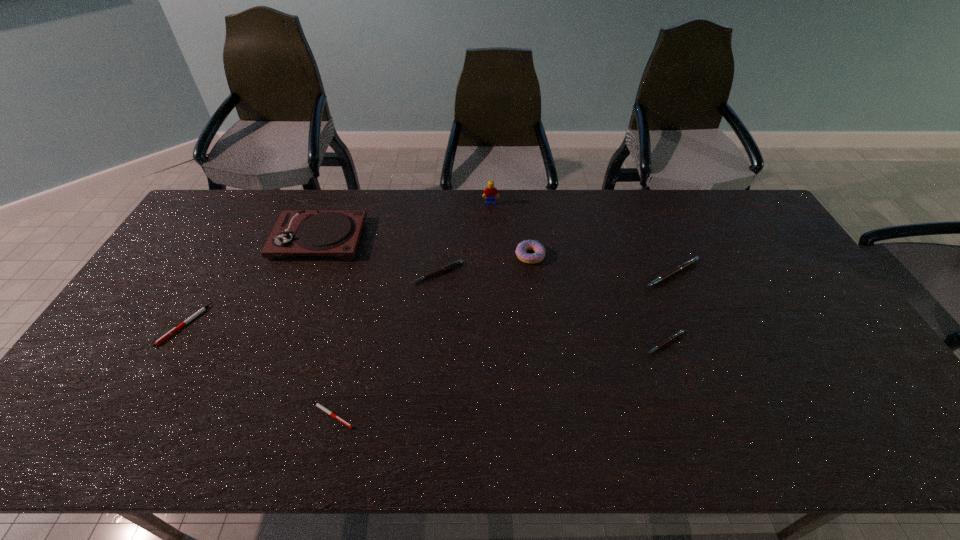
Identify the location of vacant point at the near left corner. (51, 432).

You are a GUI agent. You are given a task and a screenshot of the screen. Output one action in this format:
    pyautogui.click(x=<x>, y=<y>)
    Task: Click on the free space that is in between the doughnut and the tallest pen
    This screenshot has width=960, height=540.
    Given the screenshot: What is the action you would take?
    pyautogui.click(x=601, y=265)

The width and height of the screenshot is (960, 540). What are the coordinates of `free spot between the left white pen and the biggest pink pen` in the screenshot? It's located at (428, 299).

You are a GUI agent. You are given a task and a screenshot of the screen. Output one action in this format:
    pyautogui.click(x=<x>, y=<y>)
    Task: Click on the free spot between the third object from right to left and the Lego
    
    Given the screenshot: What is the action you would take?
    pos(511,230)

The image size is (960, 540). I want to click on empty space that is in between the leftmost pen and the purple doughnut, so click(x=357, y=291).

Locate an element on the screen. Image resolution: width=960 pixels, height=540 pixels. free point between the leftmost pink pen and the Lego is located at coordinates tap(465, 238).

The image size is (960, 540). I want to click on blank region between the second biggest pink pen and the second tallest object, so click(378, 256).

Image resolution: width=960 pixels, height=540 pixels. I want to click on vacant point located between the left white pen and the nearest pink pen, so click(425, 334).

Identify the location of free spot between the shortest pen and the biggest pink pen. Image resolution: width=960 pixels, height=540 pixels. (502, 345).

You are a GUI agent. You are given a task and a screenshot of the screen. Output one action in this format:
    pyautogui.click(x=<x>, y=<y>)
    Task: Click on the free space between the bigger white pen and the leftmost pink pen
    
    Given the screenshot: What is the action you would take?
    pyautogui.click(x=311, y=299)